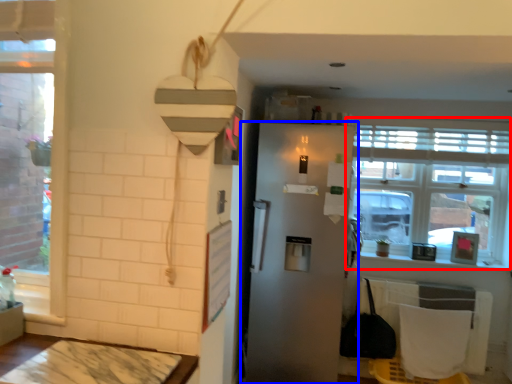
Question: Which point is closer to the camera, window (highlighted by a red box) or refrigerator (highlighted by a blue box)?

Choices:
 (A) window
 (B) refrigerator

Answer: (B)